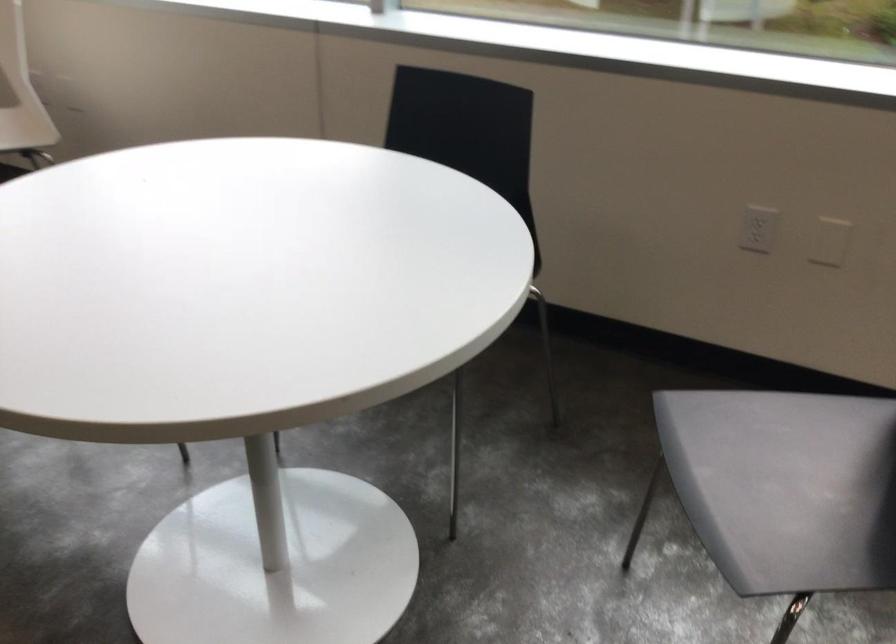
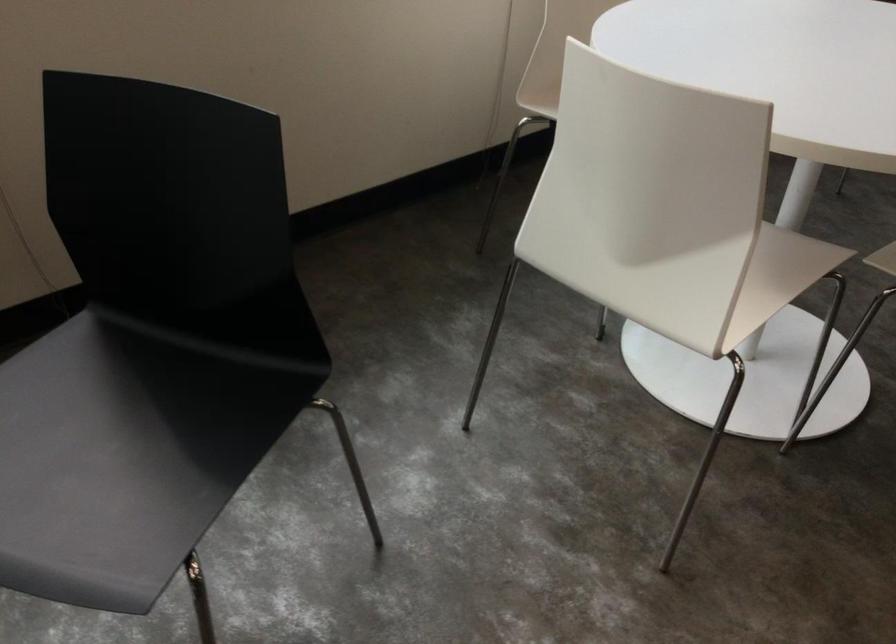
In the second image, find the point that corresponds to pixel 802 489 in the first image.

(124, 459)